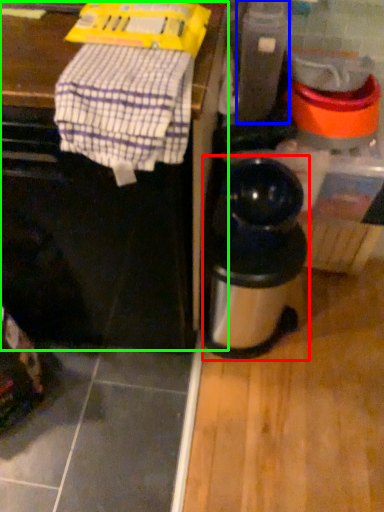
Question: Which object is the closest to the kitchen appliance (highlighted by a red box)? Choose among these: appliance (highlighted by a blue box) or vanity (highlighted by a green box).

Choices:
 (A) appliance
 (B) vanity

Answer: (B)